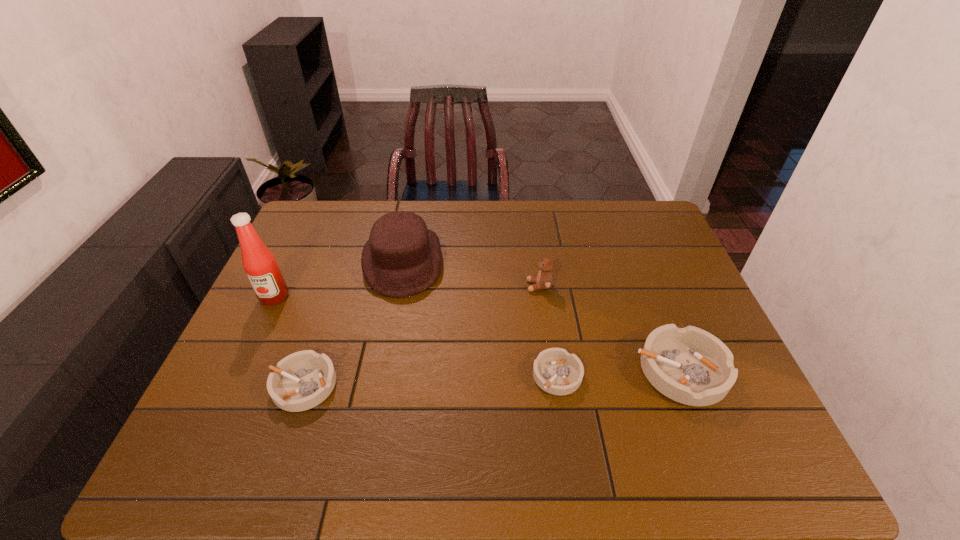
This screenshot has width=960, height=540. Identify the location of vacant region located on the back of the second shortest ashtray. (340, 279).

I want to click on free region located on the back of the second ashtray from right to left, so click(x=543, y=285).

Identify the location of free space located 0.160m on the back of the third shortest object. (651, 294).

This screenshot has height=540, width=960. Find the location of `vacant space located on the right of the hat`. vacant space located on the right of the hat is located at coordinates (x=553, y=260).

This screenshot has height=540, width=960. I want to click on free space located on the front-facing side of the teddy bear, so click(422, 286).

You are a GUI agent. You are given a task and a screenshot of the screen. Output one action in this format:
    pyautogui.click(x=<x>, y=<y>)
    Task: Click on the free space located on the front-facing side of the teddy bear
    
    Given the screenshot: What is the action you would take?
    pyautogui.click(x=446, y=286)

This screenshot has height=540, width=960. In order to click on free point located on the front-facing side of the teddy bear in this screenshot , I will do tap(443, 286).

Image resolution: width=960 pixels, height=540 pixels. I want to click on vacant area situated on the front-facing side of the condiment, so click(248, 353).

Find the location of `object situated at the far edge`. object situated at the far edge is located at coordinates (402, 258).

Where is `ashtray positioned at the left edge`? ashtray positioned at the left edge is located at coordinates (302, 380).